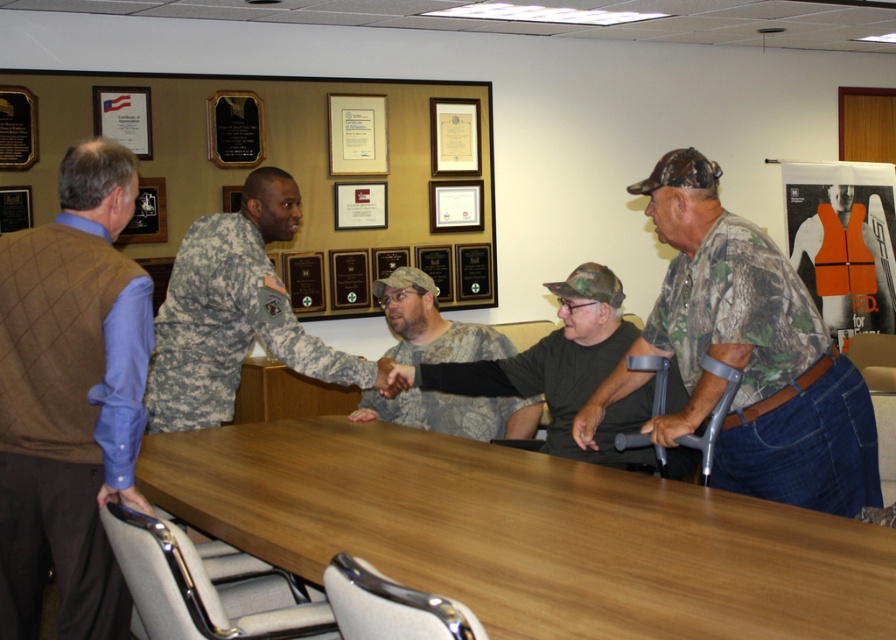
Question: Does light brown wood table at center appear over brown sweater vest at left?

Choices:
 (A) yes
 (B) no

Answer: (B)

Question: Estimate the real-world distances between objects in this image. Which object is farther from the camouflage fabric uniform at center?

Choices:
 (A) camouflage fabric shirt at center
 (B) camouflage uniform at center

Answer: (A)

Question: Which of the following is the closest to the observer?

Choices:
 (A) camouflage shirt at right
 (B) camouflage fabric uniform at center

Answer: (A)

Question: Can you confirm if brown sweater vest at left is positioned to the left of camouflage fabric uniform at center?

Choices:
 (A) no
 (B) yes

Answer: (B)

Question: Does camouflage shirt at right appear under camouflage fabric shirt at center?

Choices:
 (A) yes
 (B) no

Answer: (B)

Question: Which is nearer to the camouflage shirt at right?

Choices:
 (A) camouflage fabric uniform at center
 (B) camouflage uniform at center

Answer: (B)